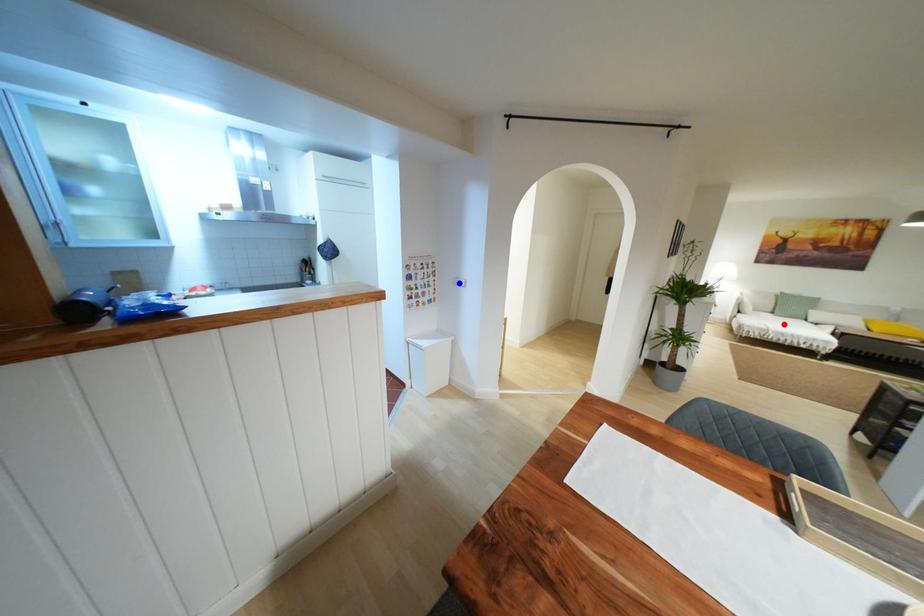
Question: Which of the two points in the image is closer to the camera?

Choices:
 (A) Blue point is closer.
 (B) Red point is closer.

Answer: (A)